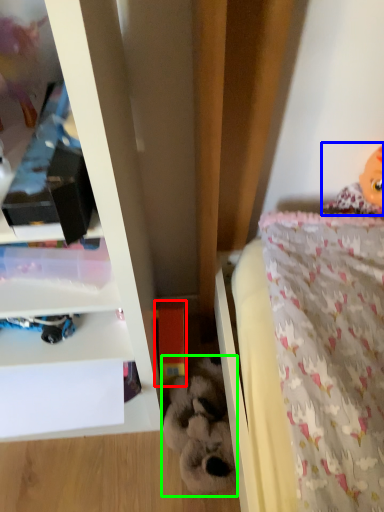
Question: Based on their relative distances, which object is farther from toy (highlighted by a red box)? Choose from doll (highlighted by a blue box) and toy (highlighted by a green box).

Choices:
 (A) doll
 (B) toy

Answer: (A)